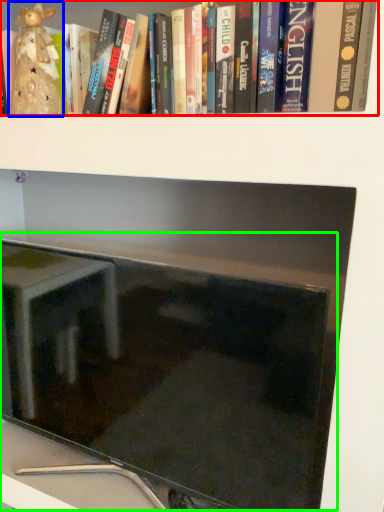
Question: Which is nearer to the book (highlighted by a red box)? figurine (highlighted by a blue box) or computer monitor (highlighted by a green box).

Choices:
 (A) figurine
 (B) computer monitor

Answer: (A)